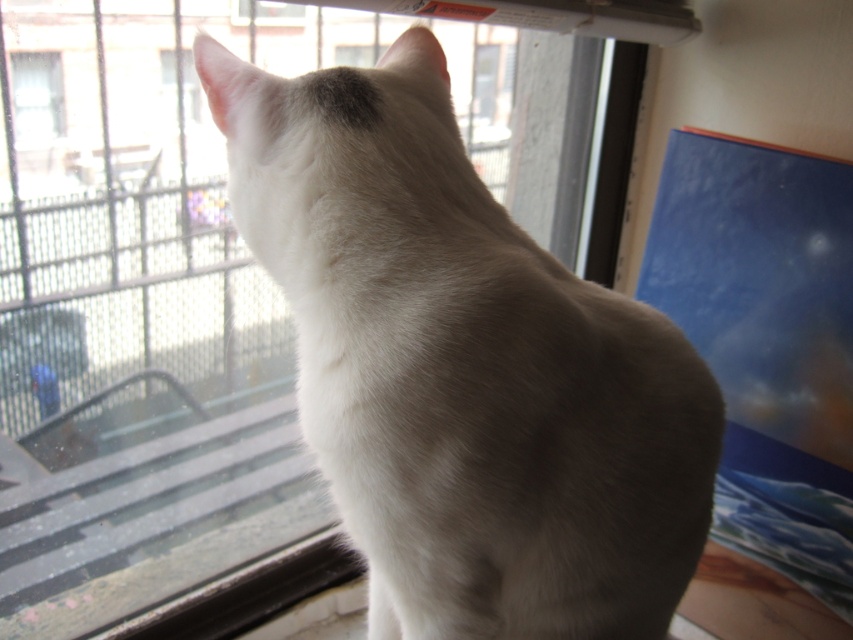
Based on the coordinates provided in the description, where is the white fur cat at center located in the image?

The white fur cat at center is located at point coordinates of [463,368].

In the scene shown: You are a visitor in a house and you see the white fur cat at center and the transparent glass window at upper left. From your perspective, which object is located to the right side?

The white fur cat at center is located to the right of the transparent glass window at upper left.

You are a visitor in a house and see the white fur cat at center and the transparent glass window at upper left. Which object is closer to the bottom edge of the image?

The white fur cat at center is closer to the bottom edge of the image because it is located below the transparent glass window at upper left.